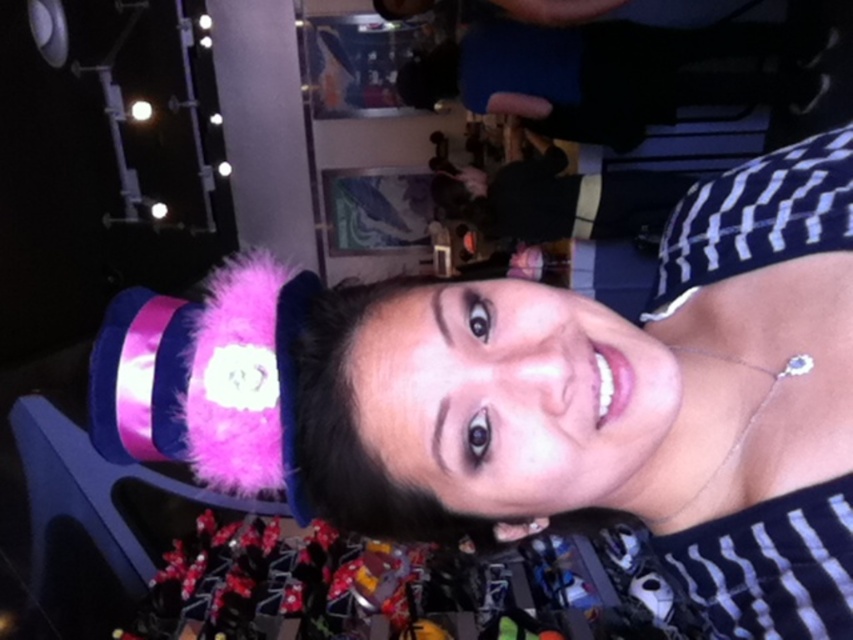
Who is more forward, (491, 472) or (567, 118)?

Positioned in front is point (491, 472).

What do you see at coordinates (622, 401) in the screenshot? I see `matte pink fur hat at upper left` at bounding box center [622, 401].

You are a GUI agent. You are given a task and a screenshot of the screen. Output one action in this format:
    pyautogui.click(x=<x>, y=<y>)
    Task: Click on the matte pink fur hat at upper left
    This screenshot has height=640, width=853.
    Given the screenshot: What is the action you would take?
    pyautogui.click(x=622, y=401)